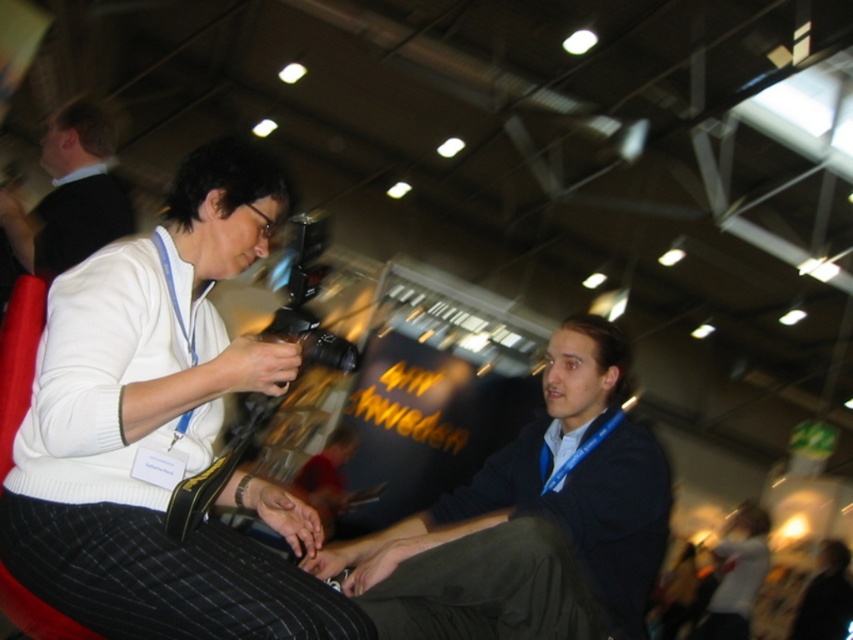
Question: Which of these objects is positioned closest to the dark blue sweater at center?

Choices:
 (A) matte white shirt at lower right
 (B) black shirt at upper left
 (C) white matte sweater at upper left

Answer: (C)

Question: Is white matte sweater at upper left behind dark blue sweater at center?

Choices:
 (A) no
 (B) yes

Answer: (A)

Question: Which point is farther to the camera?

Choices:
 (A) (297, 520)
 (B) (62, 112)
 (C) (339, 560)
 (D) (751, 602)

Answer: (D)

Question: Is black shirt at upper left bigger than matte white shirt at lower right?

Choices:
 (A) yes
 (B) no

Answer: (B)

Question: Which object appears closest to the camera in this image?

Choices:
 (A) white matte sweater at upper left
 (B) black shirt at upper left
 (C) dark blue sweater at center
 (D) matte white shirt at lower right

Answer: (A)

Question: Does black shirt at upper left have a smaller size compared to matte white shirt at lower right?

Choices:
 (A) no
 (B) yes

Answer: (B)